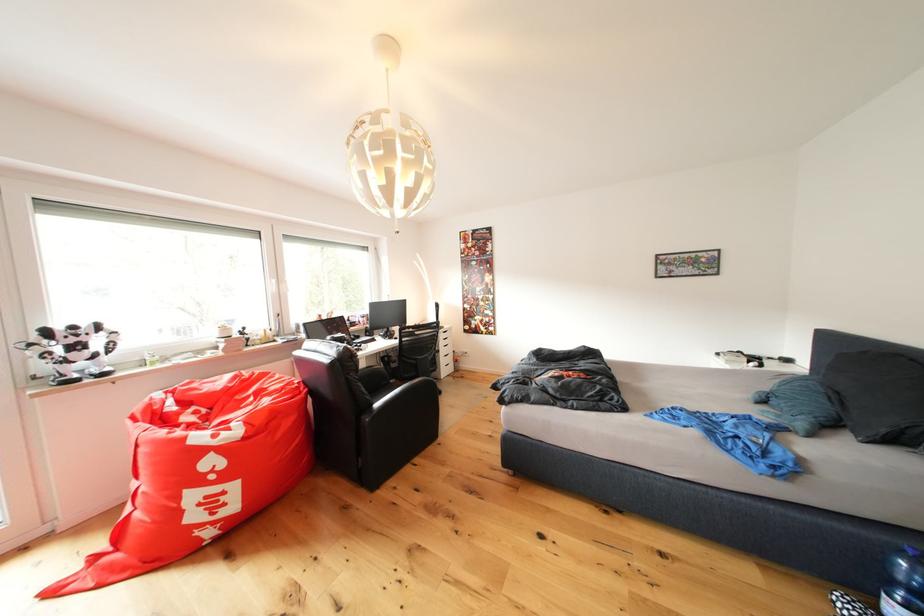
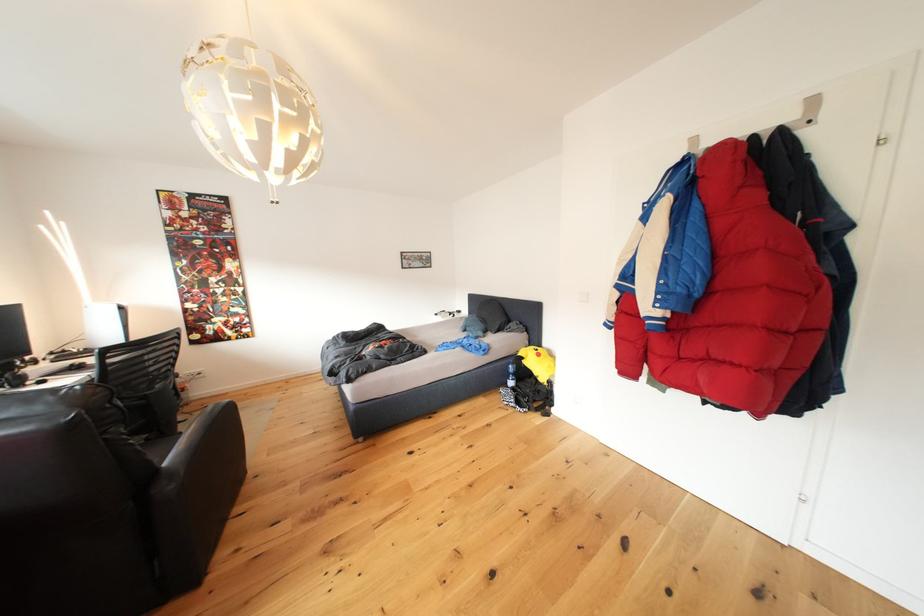
Question: How did the camera likely rotate?

Choices:
 (A) Left
 (B) Right
 (C) Up
 (D) Down

Answer: (B)